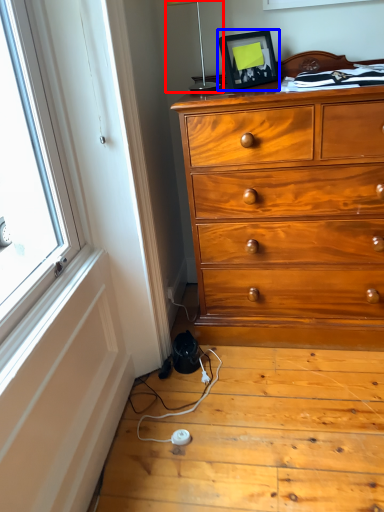
Question: Which of the following is the closest to the observer, table lamp (highlighted by a red box) or picture frame (highlighted by a blue box)?

Choices:
 (A) table lamp
 (B) picture frame

Answer: (A)